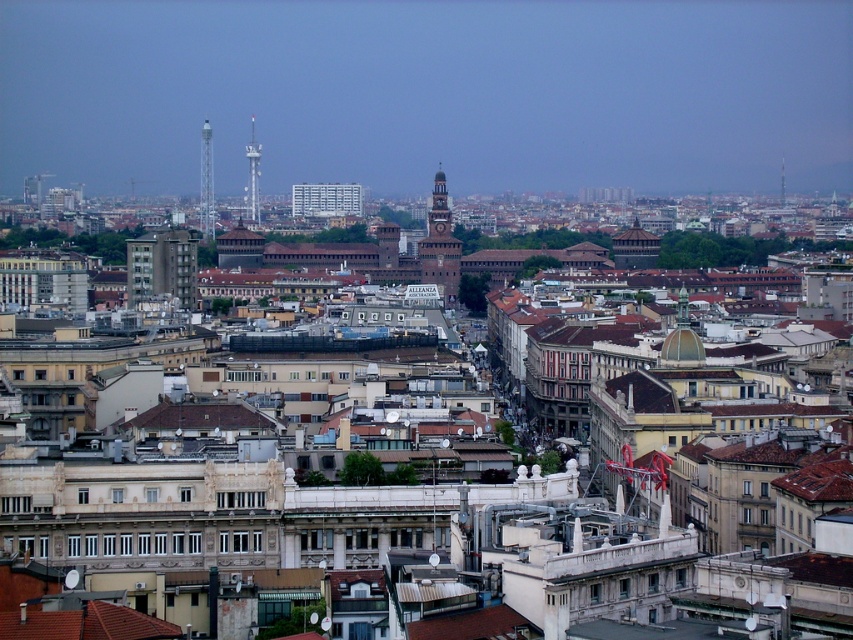
From the picture: You are a drone operator trying to navigate between two points in the city. You need to determine which point is closer to your current position. Which point, point 1 at coordinates (202, 180) or point 2 at coordinates (248, 156), is closer to you?

Point 1 at coordinates (202, 180) is closer to you because it is further to the viewer than point 2 at coordinates (248, 156).

You are a photographer standing in the city center and want to capture both the brick tower at center and the metallic silver tower at upper left in a single shot. Based on their positions, which tower should you focus on first to ensure both are in frame?

You should focus on the brick tower at center first since it is closer to the viewer than the metallic silver tower at upper left, allowing both to be captured in the frame when positioned correctly.

In the city scene described, where is the brick tower at center located in terms of coordinates?

The brick tower at center is located at coordinates point [439,232].